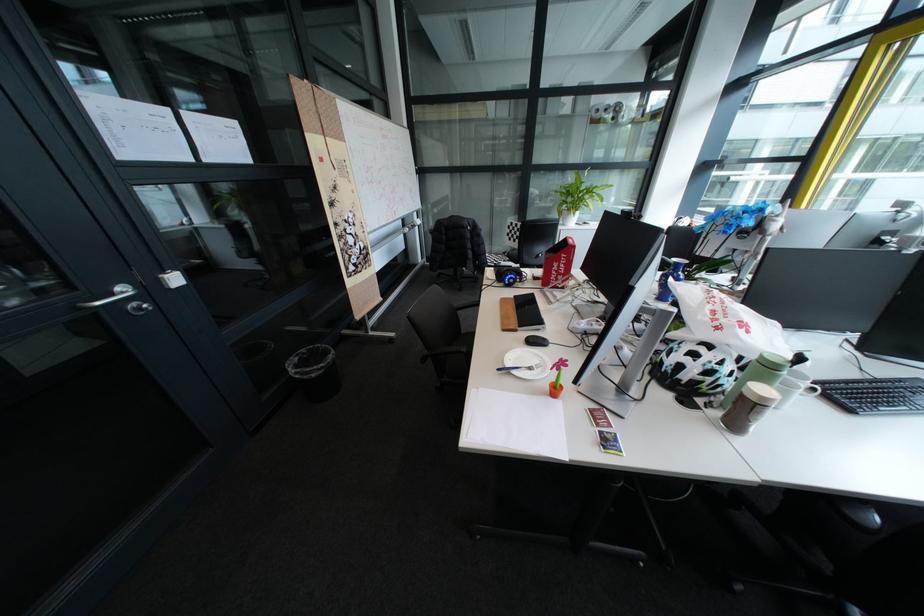
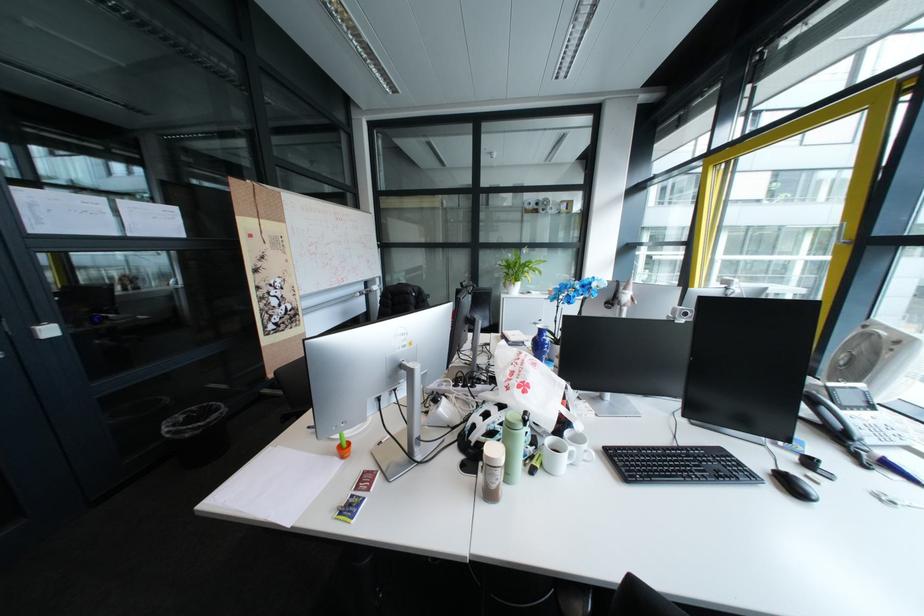
Question: The images are taken continuously from a first-person perspective. In which direction are you moving?

Choices:
 (A) Left
 (B) Right
 (C) Forward
 (D) Backward

Answer: (B)